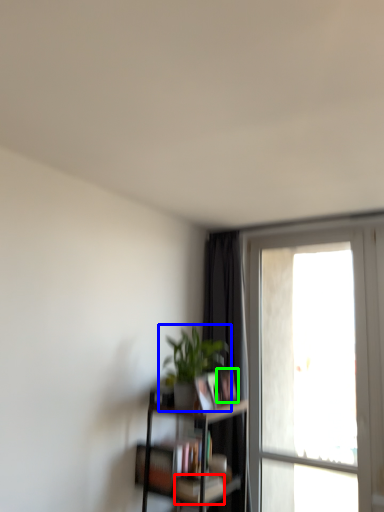
Question: Which object is the farthest from book (highlighted by a red box)? Choose among these: houseplant (highlighted by a blue box) or book (highlighted by a green box).

Choices:
 (A) houseplant
 (B) book

Answer: (A)